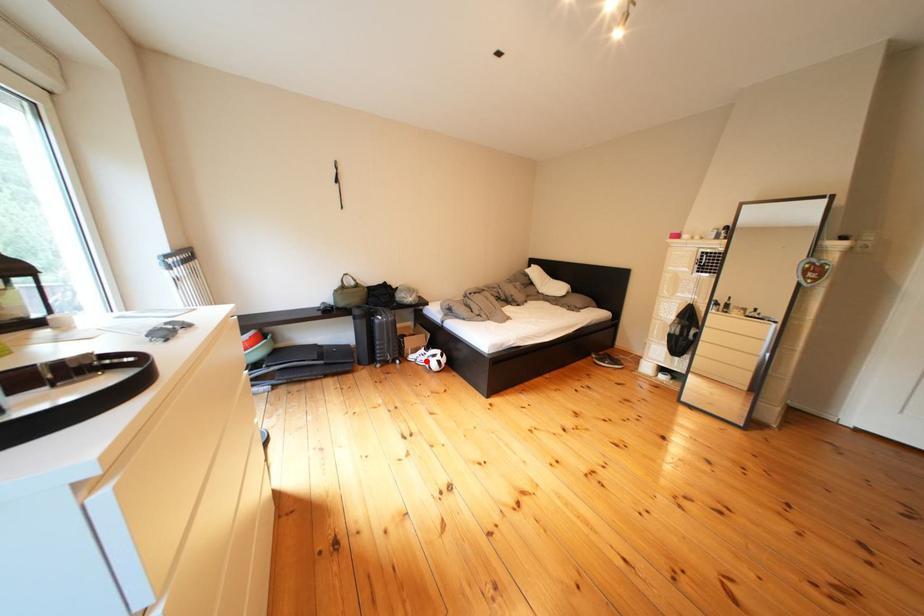
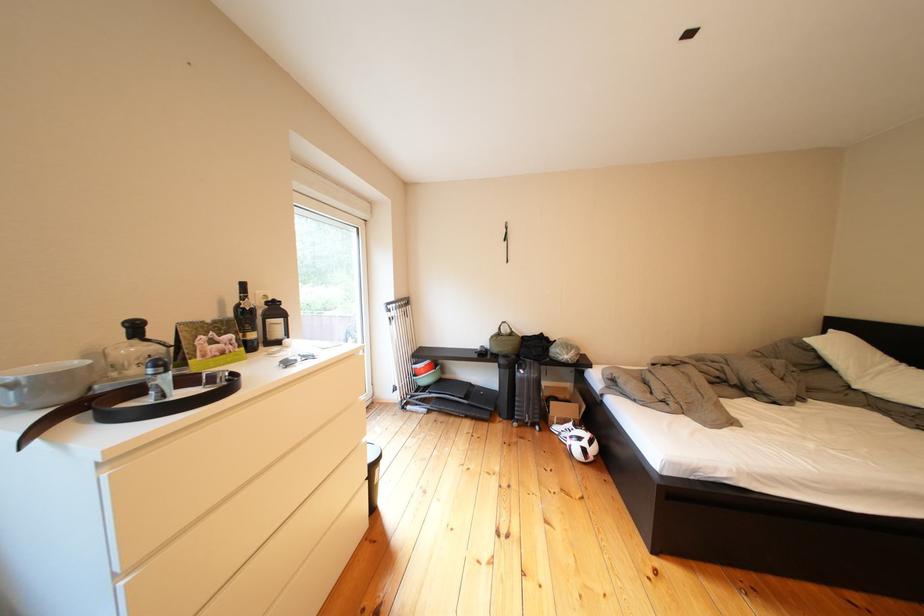
Question: I am providing you with two images of the same scene from different viewpoints. A red point is shown in image1. For the corresponding object point in image2, is it positioned nearer or farther from the camera?

Choices:
 (A) Nearer
 (B) Farther

Answer: (B)